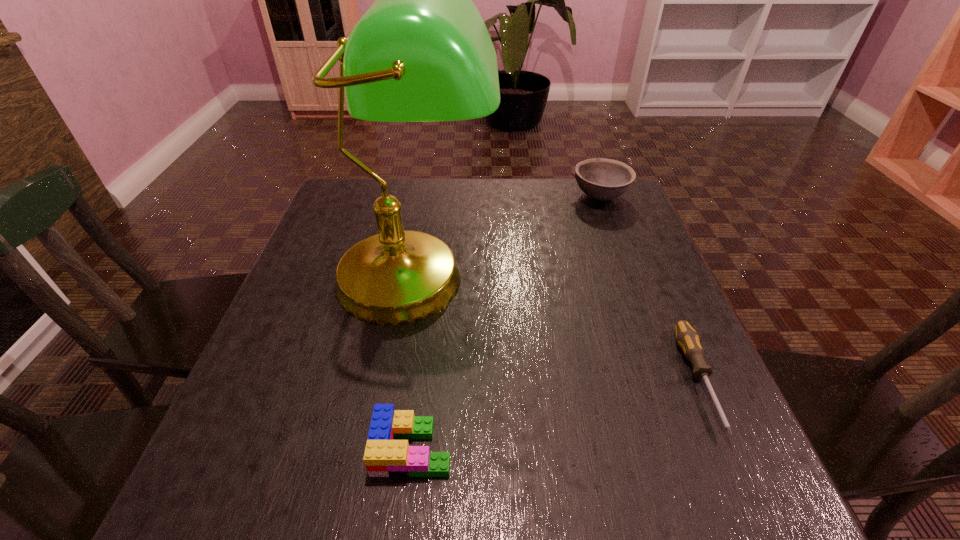
This screenshot has height=540, width=960. I want to click on free space between the farthest object and the Lego, so click(506, 322).

Identify which object is the closest to the Lego. Please provide its 2D coordinates. Your answer should be formatted as a tuple, i.e. [(x, y)], where the tuple contains the x and y coordinates of a point satisfying the conditions above.

[(421, 53)]

Identify which object is located as the second nearest to the third tallest object. Please provide its 2D coordinates. Your answer should be formatted as a tuple, i.e. [(x, y)], where the tuple contains the x and y coordinates of a point satisfying the conditions above.

[(687, 338)]